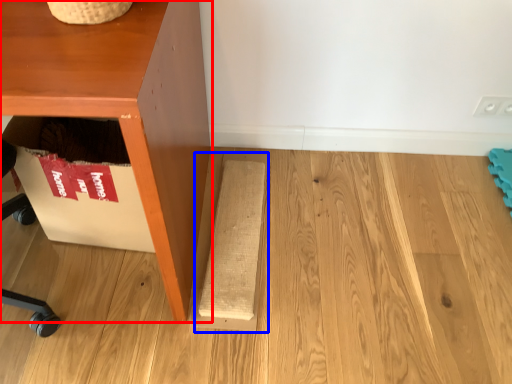
Question: Which object appears farthest to the camera in this image, furniture (highlighted by a red box) or plank (highlighted by a blue box)?

Choices:
 (A) furniture
 (B) plank

Answer: (B)